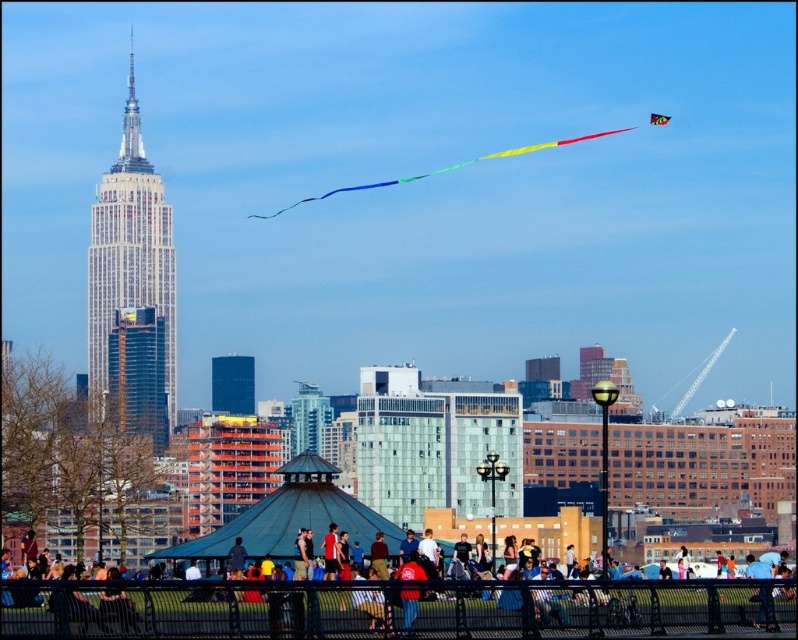
You are a photographer trying to capture the Empire State Building in the background. You notice the multicolored fabric crowd at center and the multicolored fabric kite at upper right. Which object is wider in the image?

The multicolored fabric crowd at center is wider than the multicolored fabric kite at upper right.

You are standing at the center of the image. Which direction should you move to reach the multicolored fabric crowd at center?

You are already at the center of the image, so you don not need to move to reach the multicolored fabric crowd at center.